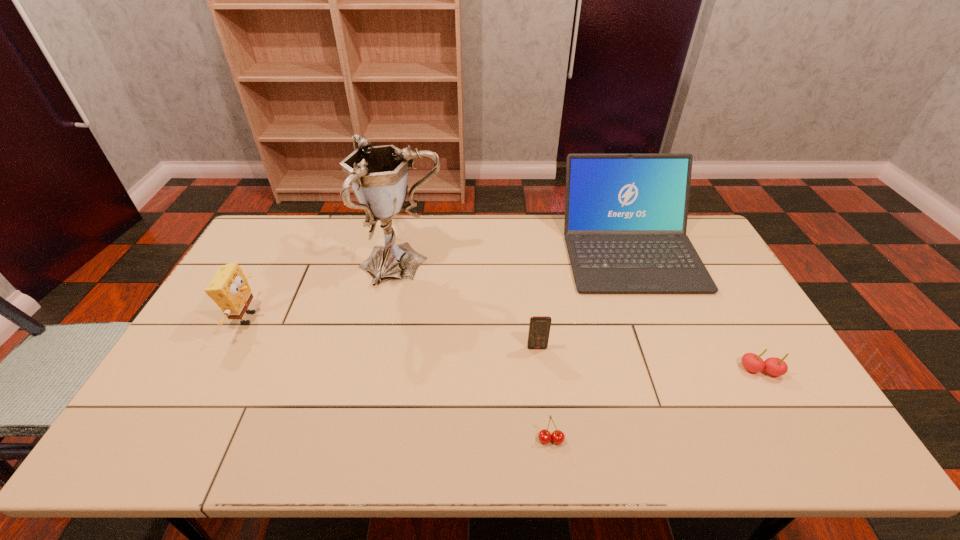
This screenshot has height=540, width=960. Find the location of `vacant area that lies between the second tallest object and the leftmost object`. vacant area that lies between the second tallest object and the leftmost object is located at coordinates (439, 285).

Locate an element on the screen. free space between the trophy cup and the cellular telephone is located at coordinates [x=469, y=306].

Locate an element on the screen. The height and width of the screenshot is (540, 960). vacant point located between the left cherry and the farther cherry is located at coordinates (656, 405).

Find the location of a particular element. The image size is (960, 540). free space between the laptop computer and the second nearest object is located at coordinates (695, 310).

Identify the location of free space between the fourth shortest object and the second object from left to right. Image resolution: width=960 pixels, height=540 pixels. (324, 291).

Locate an element on the screen. unoccupied area between the fifth shortest object and the farther cherry is located at coordinates (695, 310).

Where is `vacant area that lies between the fifth shortest object and the trophy cup`? This screenshot has width=960, height=540. vacant area that lies between the fifth shortest object and the trophy cup is located at coordinates (516, 258).

Point out which object is positioned as the fourth nearest to the cellular telephone. Please provide its 2D coordinates. Your answer should be formatted as a tuple, i.e. [(x, y)], where the tuple contains the x and y coordinates of a point satisfying the conditions above.

[(754, 363)]

This screenshot has height=540, width=960. Identify the location of object that stands as the second closest to the nearer cherry. (625, 225).

Image resolution: width=960 pixels, height=540 pixels. In order to click on free space in the image that satisfies the following two spatial constraints: 1. on the screen of the third shortest object; 2. on the left side of the right cherry in this screenshot , I will do `click(540, 370)`.